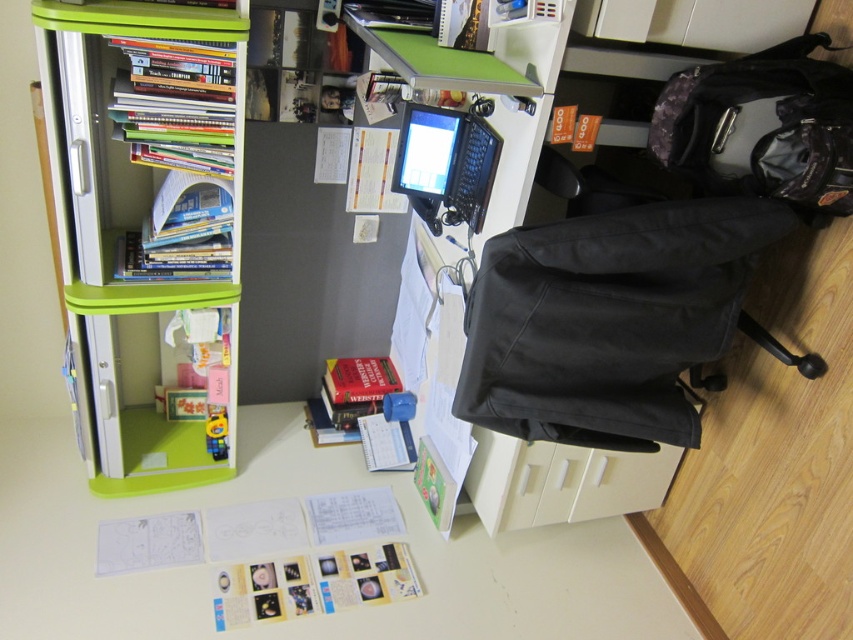
Question: Which of the following is the closest to the observer?

Choices:
 (A) (473, 125)
 (B) (630, 209)
 (C) (79, 6)

Answer: (B)

Question: Based on their relative distances, which object is nearer to the white paper at lower center?

Choices:
 (A) black plastic laptop at center
 (B) green plastic bookshelf at left

Answer: (B)

Question: Is green plastic bookshelf at left closer to the viewer compared to white paper at lower center?

Choices:
 (A) yes
 (B) no

Answer: (A)

Question: Does white paper at lower center have a lesser width compared to black fabric bag at right?

Choices:
 (A) yes
 (B) no

Answer: (B)

Question: Where is white paper at lower center located in relation to black plastic laptop at center in the image?

Choices:
 (A) above
 (B) below

Answer: (B)

Question: Which point is farther from the camera taking this photo?

Choices:
 (A) (136, 243)
 (B) (425, 147)

Answer: (A)